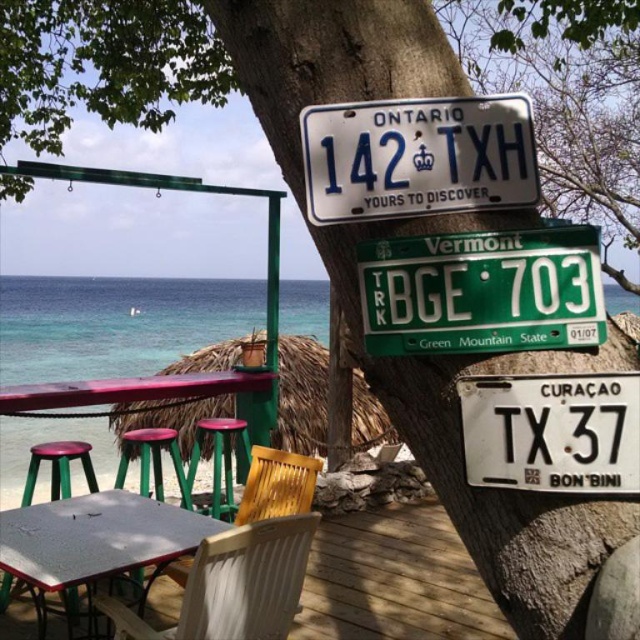
Which of these two, white matte license plate at center-right or green plastic stool at lower center, stands taller?

green plastic stool at lower center

Between white matte license plate at center-right and green plastic stool at lower center, which one appears on the right side from the viewer's perspective?

Positioned to the right is white matte license plate at center-right.

Is point (557, 420) in front of point (250, 460)?

That is True.

Identify the location of white matte license plate at center-right. Image resolution: width=640 pixels, height=640 pixels. (552, 432).

This screenshot has width=640, height=640. What do you see at coordinates (417, 156) in the screenshot?
I see `white plastic license plate at upper center` at bounding box center [417, 156].

I want to click on white plastic license plate at upper center, so click(417, 156).

Identify the location of white plastic license plate at upper center. Image resolution: width=640 pixels, height=640 pixels. (417, 156).

Looking at this image, is white plastic license plate at upper center positioned in front of wooden picnic table at lower left?

Yes, it is in front of wooden picnic table at lower left.

Does point (428, 113) lie behind point (220, 376)?

No, (428, 113) is in front of (220, 376).

Between point (440, 164) and point (218, 378), which one is positioned in front?

Positioned in front is point (440, 164).

Where is `white plastic license plate at upper center`? The image size is (640, 640). white plastic license plate at upper center is located at coordinates (417, 156).